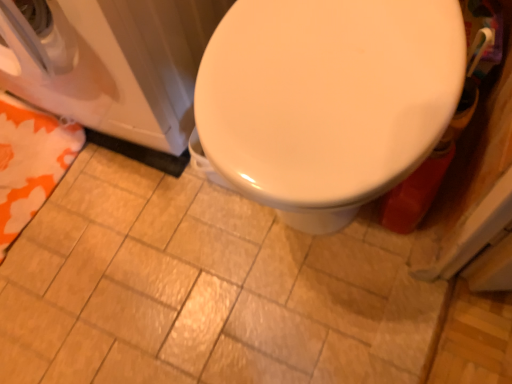
Question: In terms of width, does orange fabric towel at lower left look wider or thinner when compared to white glossy washer at left?

Choices:
 (A) thin
 (B) wide

Answer: (A)

Question: From the image's perspective, relative to white glossy washer at left, is orange fabric towel at lower left above or below?

Choices:
 (A) below
 (B) above

Answer: (A)

Question: Estimate the real-world distances between objects in this image. Which object is farther from the orange fabric towel at lower left?

Choices:
 (A) white glossy washer at left
 (B) matte ceramic tile at center

Answer: (B)

Question: Estimate the real-world distances between objects in this image. Which object is closer to the white glossy washer at left?

Choices:
 (A) matte ceramic tile at center
 (B) orange fabric towel at lower left

Answer: (B)